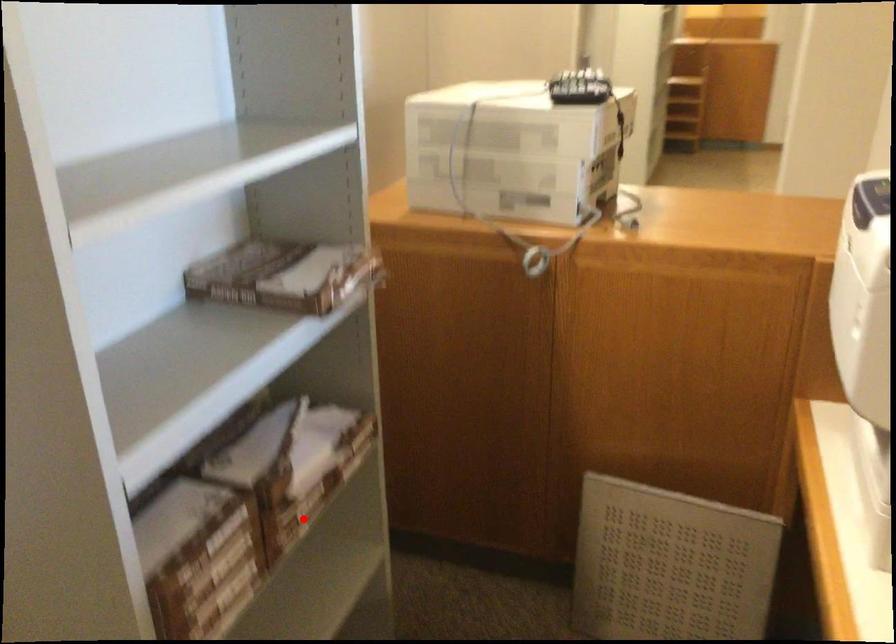
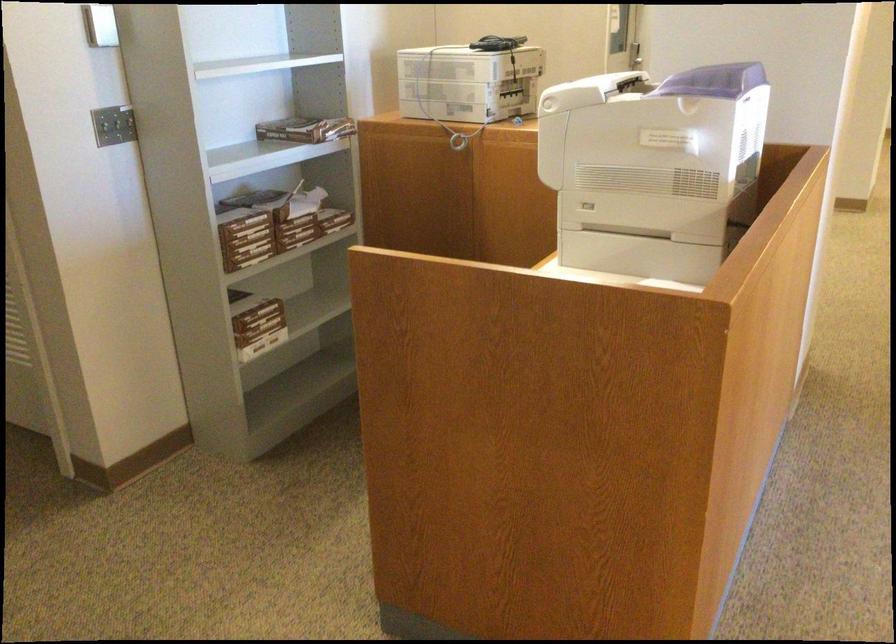
Question: A red point is marked in image1. In image2, is the corresponding 3D point closer to the camera or farther? Reply with the corresponding letter.

Choices:
 (A) The corresponding 3D point is closer.
 (B) The corresponding 3D point is farther.

Answer: (B)